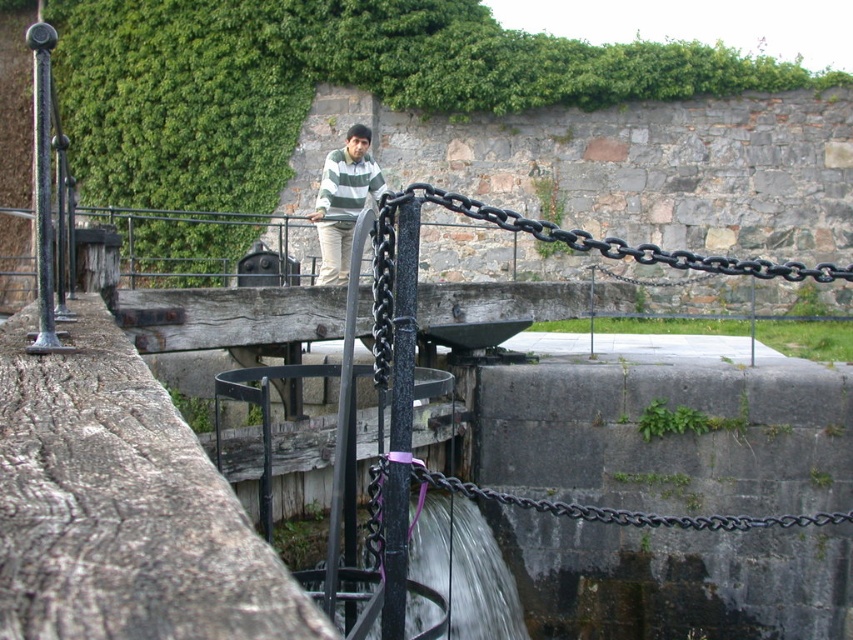
Question: Which point is closer to the camera taking this photo?

Choices:
 (A) (442, 483)
 (B) (331, 161)

Answer: (A)

Question: Can you confirm if striped sweater at center is smaller than black metal chain at lower center?

Choices:
 (A) yes
 (B) no

Answer: (B)

Question: Does striped sweater at center appear on the right side of black metal chain at lower center?

Choices:
 (A) no
 (B) yes

Answer: (A)

Question: Which point appears closest to the camera in this image?

Choices:
 (A) (750, 518)
 (B) (328, 205)

Answer: (A)

Question: Is striped sweater at center closer to camera compared to black metal chain at lower center?

Choices:
 (A) yes
 (B) no

Answer: (B)

Question: Which of the following is the farthest from the observer?

Choices:
 (A) striped sweater at center
 (B) black metal chain at lower center
 (C) black metal chain at upper center

Answer: (A)